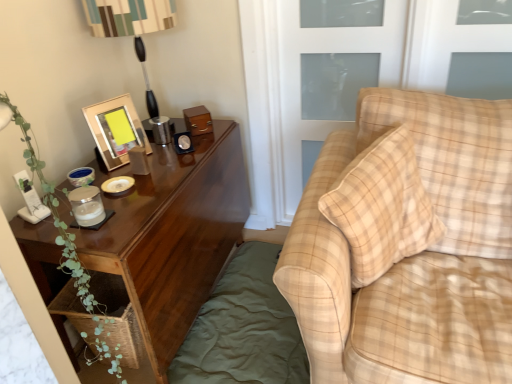
Question: From their relative heights in the image, would you say green cotton bedding at lower left is taller or shorter than plaid fabric couch at right?

Choices:
 (A) short
 (B) tall

Answer: (A)

Question: In terms of size, does green cotton bedding at lower left appear bigger or smaller than plaid fabric couch at right?

Choices:
 (A) big
 (B) small

Answer: (B)

Question: Which is nearer to the green leafy plant at left?

Choices:
 (A) plaid fabric couch at right
 (B) clear glass screen door at upper right
 (C) green cotton bedding at lower left
 (D) woodenobject at upper left
 (E) wooden table lamp at upper left

Answer: (D)

Question: Estimate the real-world distances between objects in this image. Which object is closer to the green cotton bedding at lower left?

Choices:
 (A) woodenobject at upper left
 (B) transparent glass door at upper right
 (C) clear glass screen door at upper right
 (D) plaid fabric couch at right
 (E) wooden table lamp at upper left

Answer: (D)